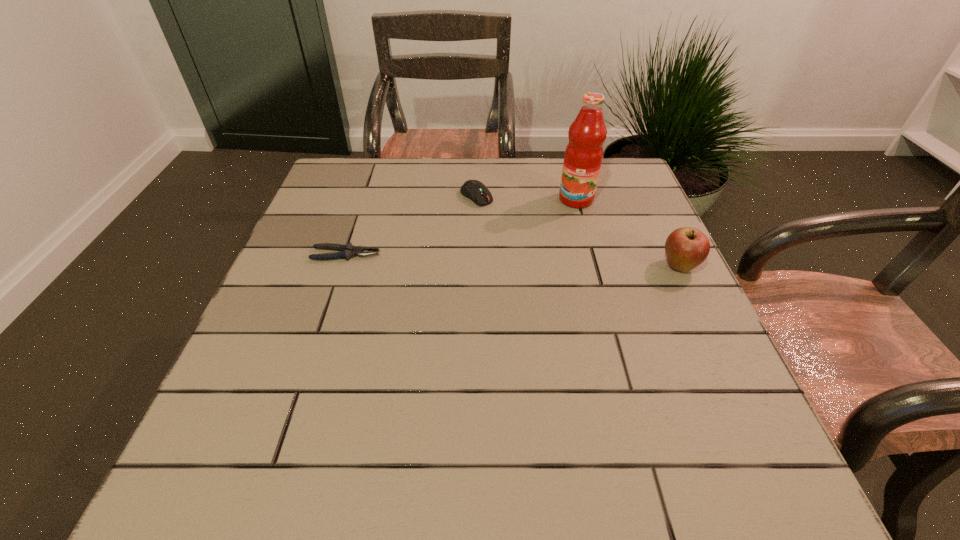
Locate an element on the screen. free space located 0.130m on the button of the second shortest object is located at coordinates (514, 232).

You are a GUI agent. You are given a task and a screenshot of the screen. Output one action in this format:
    pyautogui.click(x=<x>, y=<y>)
    Task: Click on the vacant area located on the button of the second shortest object
    The width and height of the screenshot is (960, 540).
    Given the screenshot: What is the action you would take?
    pyautogui.click(x=549, y=265)

Locate an element on the screen. vacant space situated 0.160m on the button of the second shortest object is located at coordinates (520, 238).

At what (x,y) coordinates should I click in order to perform the action: click on vacant region located on the front label of the fruit juice. Please return your answer as a coordinate pair (x, y). The height and width of the screenshot is (540, 960). Looking at the image, I should click on (542, 288).

Identify the location of vacant region located on the front label of the fruit juice. The image size is (960, 540). (558, 248).

This screenshot has width=960, height=540. Find the location of `free spot located on the front label of the fruit juice`. free spot located on the front label of the fruit juice is located at coordinates (539, 298).

Where is `computer equipment located in the far edge section of the desktop`? The width and height of the screenshot is (960, 540). computer equipment located in the far edge section of the desktop is located at coordinates (475, 190).

Locate an element on the screen. This screenshot has height=540, width=960. fruit juice that is at the far edge is located at coordinates (583, 156).

Image resolution: width=960 pixels, height=540 pixels. In order to click on object that is at the left edge in this screenshot , I will do `click(347, 251)`.

This screenshot has height=540, width=960. Find the location of `apple positioned at the right edge`. apple positioned at the right edge is located at coordinates (686, 248).